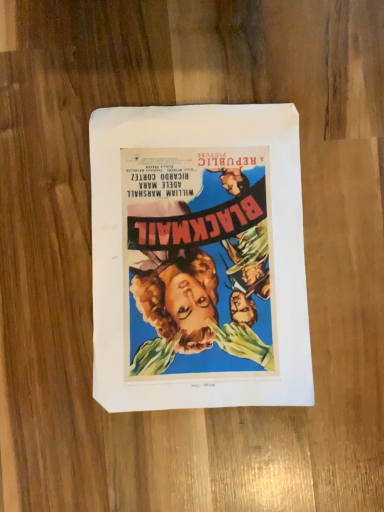
Where is `matte paper poster at center`? The height and width of the screenshot is (512, 384). matte paper poster at center is located at coordinates (198, 258).

The width and height of the screenshot is (384, 512). Describe the element at coordinates (198, 258) in the screenshot. I see `matte paper poster at center` at that location.

Where is `matte paper poster at center`? The height and width of the screenshot is (512, 384). matte paper poster at center is located at coordinates (198, 258).